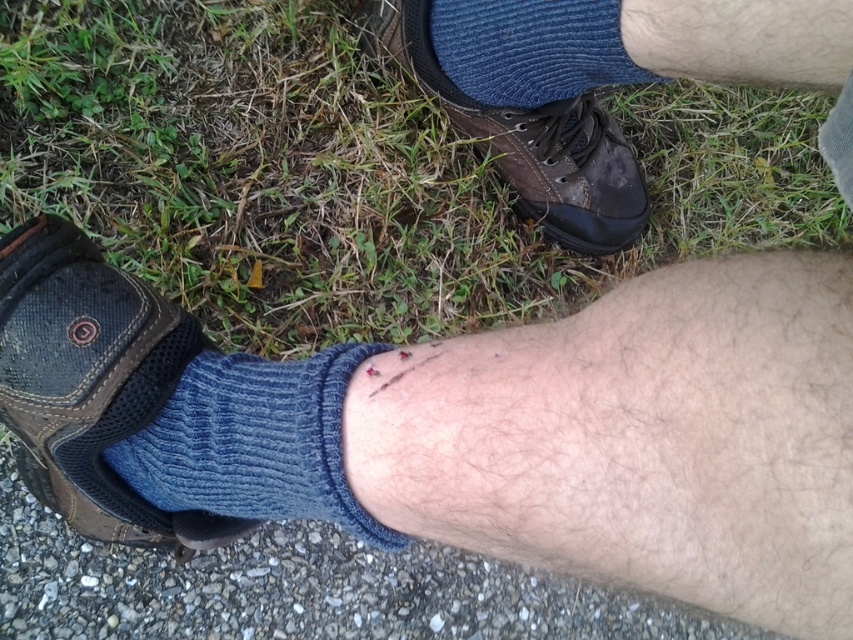
Between point (120, 529) and point (595, 45), which one is positioned in front?

Point (595, 45) is in front.

Consider the image. Can you confirm if dark brown leather shoe at lower left is bigger than blue knitted sock at upper center?

Yes, dark brown leather shoe at lower left is bigger than blue knitted sock at upper center.

The width and height of the screenshot is (853, 640). What do you see at coordinates (90, 381) in the screenshot?
I see `dark brown leather shoe at lower left` at bounding box center [90, 381].

Where is `dark brown leather shoe at lower left`? This screenshot has height=640, width=853. dark brown leather shoe at lower left is located at coordinates click(x=90, y=381).

Does blue knitted sock at lower center have a greater width compared to leather shoe at center?

Incorrect, blue knitted sock at lower center's width does not surpass leather shoe at center's.

Does point (184, 394) lie in front of point (397, 3)?

Yes, it is in front of point (397, 3).

At what (x,y) coordinates should I click in order to perform the action: click on blue knitted sock at lower center. Please return your answer as a coordinate pair (x, y). The image size is (853, 640). Looking at the image, I should click on (253, 442).

Which is behind, point (102, 328) or point (178, 419)?

The point (178, 419) is behind.

Which of these two, dark brown leather shoe at lower left or blue knitted sock at lower center, stands taller?

dark brown leather shoe at lower left

Is point (144, 380) positioned before point (239, 429)?

No, it is behind (239, 429).

The height and width of the screenshot is (640, 853). I want to click on dark brown leather shoe at lower left, so click(x=90, y=381).